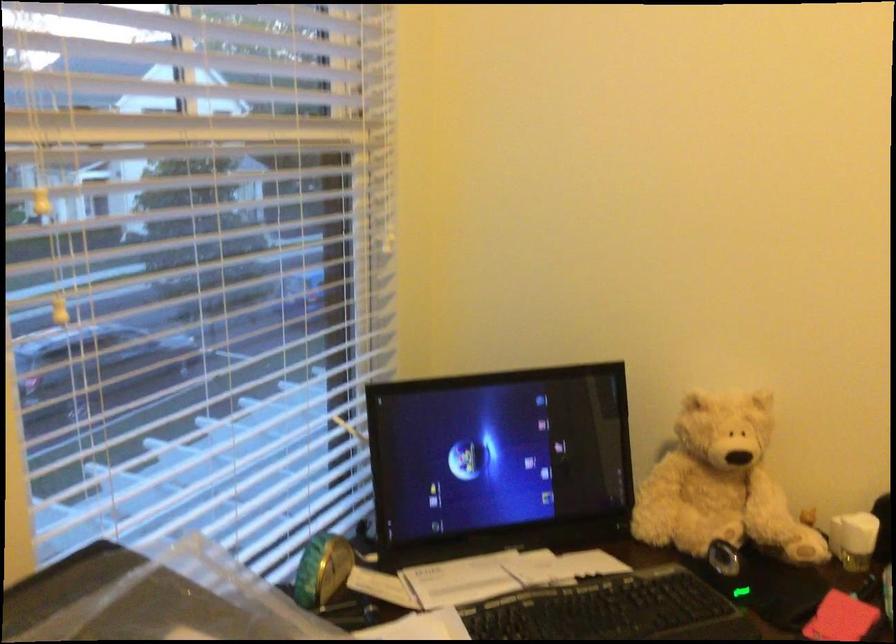
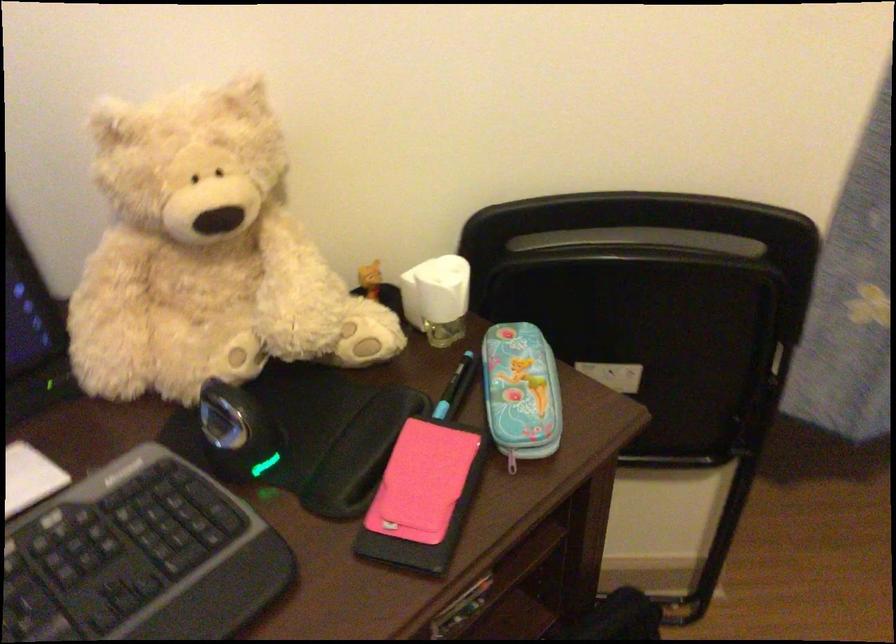
In the second image, find the point that corresponds to (712,469) in the first image.

(205, 254)